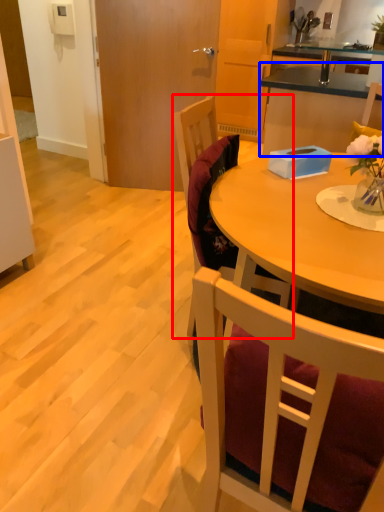
Question: Among these objects, which one is farthest to the camera, chair (highlighted by a red box) or cabinetry (highlighted by a blue box)?

Choices:
 (A) chair
 (B) cabinetry

Answer: (B)